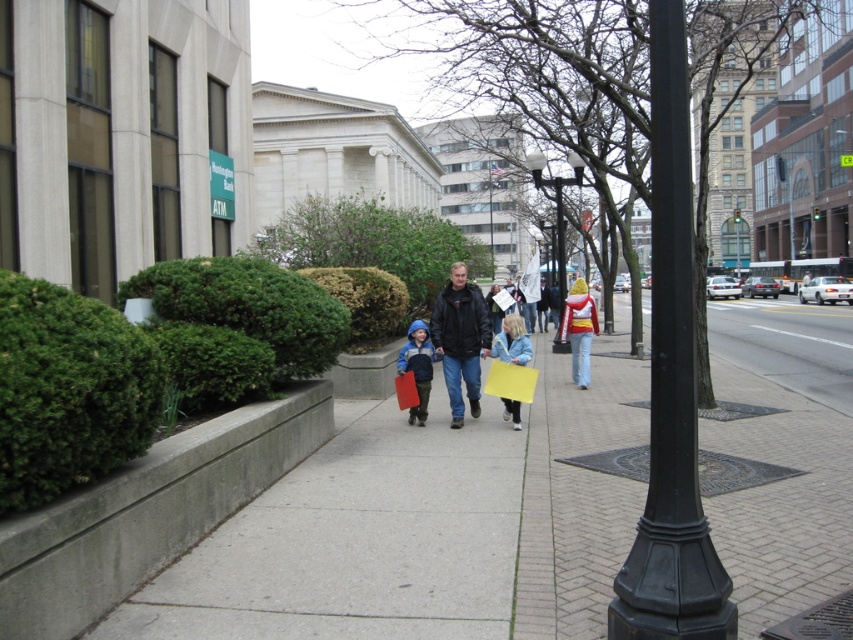
You are a photographer taking a picture of the matte black jacket at center and the light blue denim jacket at center. Which jacket should you focus on first if you want to capture both in the same frame?

The matte black jacket at center is located below the light blue denim jacket at center, so you should focus on the light blue denim jacket at center first to ensure both are in the frame.

You are a photographer trying to capture both the matte black jacket at center and the light blue denim jacket at center in the same frame. Based on their sizes, which jacket should you focus on first to ensure both are clearly visible in your photo?

The matte black jacket at center is larger in size than the light blue denim jacket at center, so you should focus on the matte black jacket at center first to ensure it is in clear focus while the smaller light blue denim jacket at center will remain sharp in the background.

You are a drone operator trying to capture a photo of the concrete sidewalk at center from above. What are the coordinates where you should position the camera to ensure the sidewalk is centered in the frame?

The coordinates for the concrete sidewalk at center are at point (422, 525), so position the camera at those coordinates to center it in the frame.